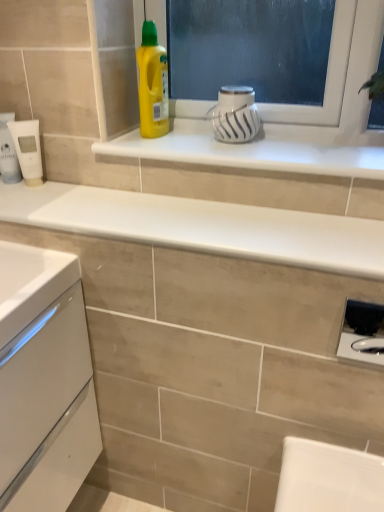
I want to click on free space to the right of white glossy mug at upper center, which is the 2th appliance in left-to-right order, so click(x=297, y=144).